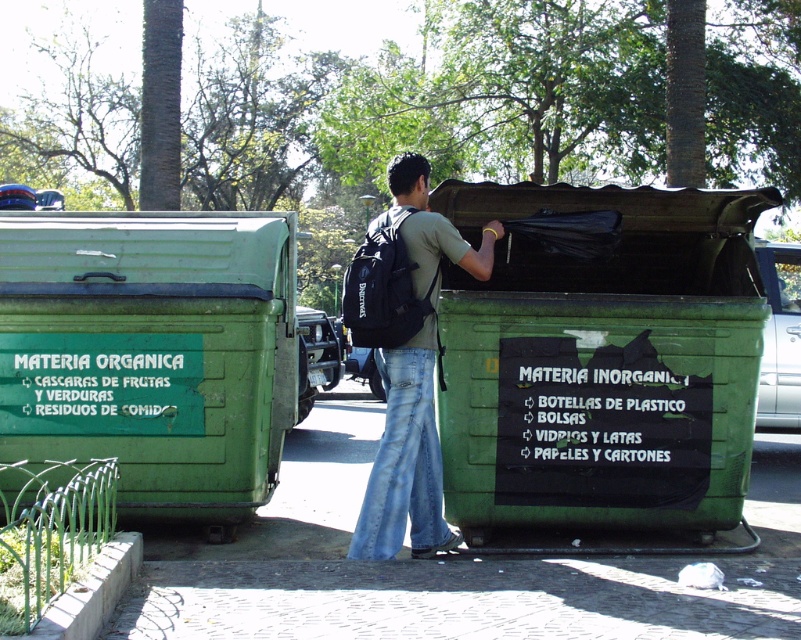
Question: Can you confirm if green matte plastic at left is smaller than jeans at center?

Choices:
 (A) no
 (B) yes

Answer: (A)

Question: Which point is farther to the camera?

Choices:
 (A) jeans at center
 (B) green matte plastic recycling bin at center

Answer: (B)

Question: Does green matte plastic at left come behind jeans at center?

Choices:
 (A) no
 (B) yes

Answer: (B)

Question: Based on their relative distances, which object is nearer to the jeans at center?

Choices:
 (A) green matte plastic recycling bin at center
 (B) green matte plastic at left

Answer: (A)

Question: Which point appears closest to the camera in this image?

Choices:
 (A) (413, 342)
 (B) (586, 257)
 (C) (43, 352)

Answer: (A)

Question: Is green matte plastic at left bigger than jeans at center?

Choices:
 (A) yes
 (B) no

Answer: (A)